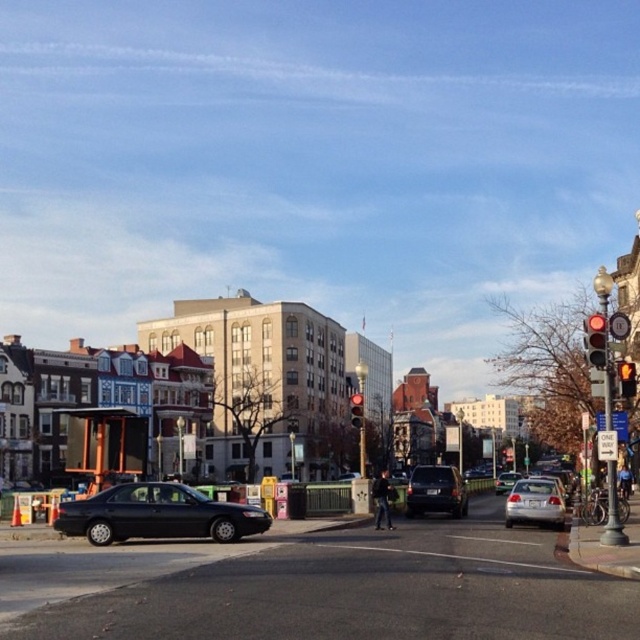
You are a delivery driver who needs to park your truck, which is 2 meters wide, in the space between the matte black suv at center and the red glass traffic light at upper right. Can your truck fit there?

The matte black suv at center is bigger than the red glass traffic light at upper right, but the question is about the space between them. The description does not provide information about the distance between the two objects. Therefore, it is impossible to determine if the truck can fit based on the given information.